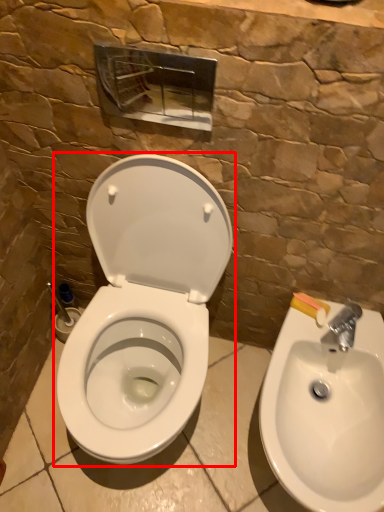
Question: Considering the relative positions of toilet (annotated by the red box) and sink in the image provided, where is toilet (annotated by the red box) located with respect to the staircase?

Choices:
 (A) left
 (B) right

Answer: (A)